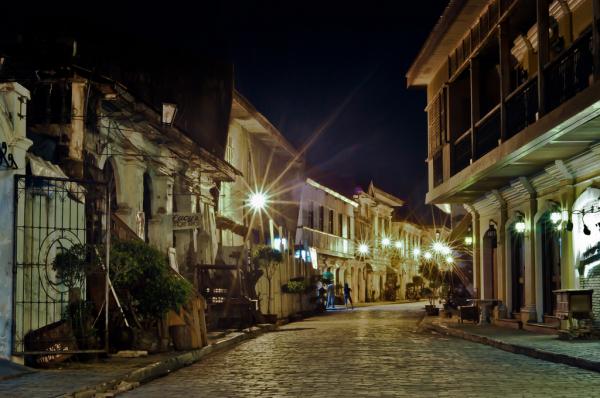
This screenshot has height=398, width=600. I want to click on pillars, so click(x=556, y=199).